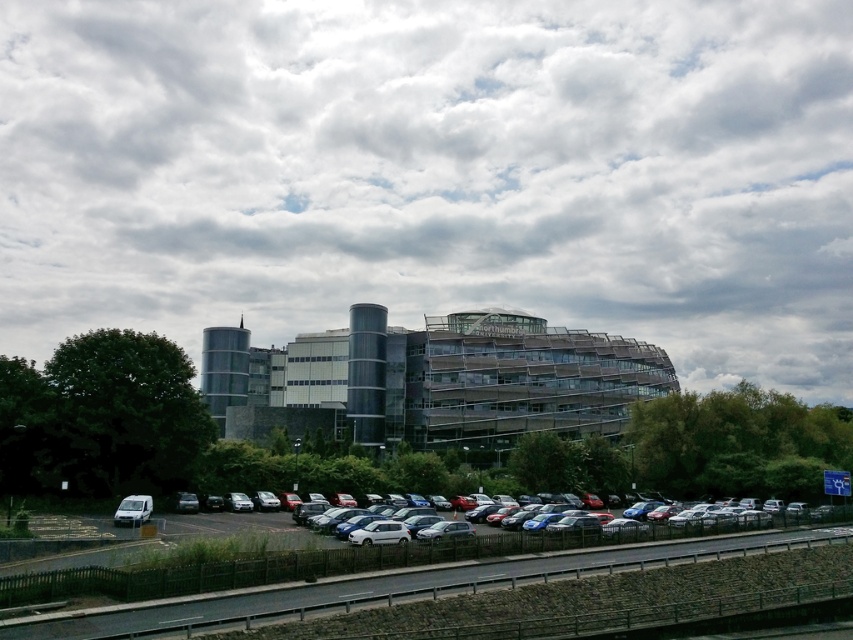
Who is more forward, (775, 248) or (718, 502)?

Positioned in front is point (718, 502).

What do you see at coordinates (434, 172) in the screenshot? The image size is (853, 640). I see `cloudy sky at upper center` at bounding box center [434, 172].

Where is `cloudy sky at upper center`? The height and width of the screenshot is (640, 853). cloudy sky at upper center is located at coordinates (434, 172).

Who is lower down, metallic silver car at center or white matte van at lower left?

Positioned lower is metallic silver car at center.

Can you confirm if metallic silver car at center is wider than white matte van at lower left?

Correct, the width of metallic silver car at center exceeds that of white matte van at lower left.

At what (x,y) coordinates should I click in order to perform the action: click on metallic silver car at center. Please return your answer as a coordinate pair (x, y). Image resolution: width=853 pixels, height=640 pixels. Looking at the image, I should click on (230, 524).

Image resolution: width=853 pixels, height=640 pixels. What do you see at coordinates (393, 586) in the screenshot? I see `dark asphalt highway at lower center` at bounding box center [393, 586].

Can you confirm if dark asphalt highway at lower center is bigger than metallic silver car at center?

Actually, dark asphalt highway at lower center might be smaller than metallic silver car at center.

What are the coordinates of `dark asphalt highway at lower center` in the screenshot? It's located at point(393,586).